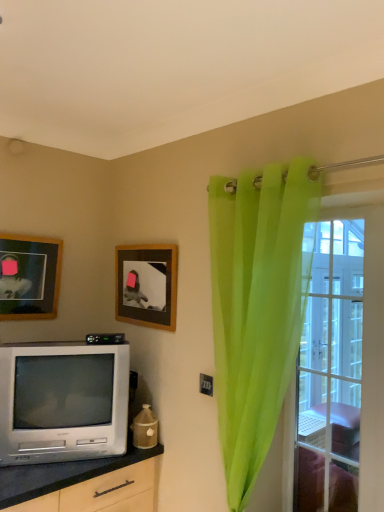
Describe the element at coordinates (146, 285) in the screenshot. I see `wooden picture frame at upper center, marked as the 1th picture frame in a right-to-left arrangement` at that location.

Where is `wooden picture frame at upper center, which is counted as the 2th picture frame, starting from the left`? This screenshot has width=384, height=512. wooden picture frame at upper center, which is counted as the 2th picture frame, starting from the left is located at coordinates (146, 285).

Identify the location of wooden picture frame at upper left, the second picture frame in the right-to-left sequence. (29, 277).

Where is `silver metallic television at lower left`? This screenshot has width=384, height=512. silver metallic television at lower left is located at coordinates point(63,402).

Locate an element on the screen. This screenshot has height=512, width=384. wooden picture frame at upper center, marked as the 1th picture frame in a right-to-left arrangement is located at coordinates (146, 285).

From a real-world perspective, does silver metallic television at lower left sit lower than translucent green curtain at right?

Yes, from a real-world perspective, silver metallic television at lower left is below translucent green curtain at right.

At what (x,y) coordinates should I click in order to perform the action: click on television lying on the left of translucent green curtain at right. Please return your answer as a coordinate pair (x, y). Looking at the image, I should click on (63, 402).

Which is behind, point (122, 408) or point (255, 242)?

The point (122, 408) is more distant.

Is silver metallic television at lower left thinner than translucent green curtain at right?

In fact, silver metallic television at lower left might be wider than translucent green curtain at right.

Would you say clear glass door at right contains silver metallic television at lower left?

→ That's incorrect, silver metallic television at lower left is not inside clear glass door at right.

Can you confirm if clear glass door at right is thinner than silver metallic television at lower left?

Correct, the width of clear glass door at right is less than that of silver metallic television at lower left.

This screenshot has width=384, height=512. Identify the location of window located on the right of silver metallic television at lower left. (341, 369).

Considering the sizes of clear glass door at right and silver metallic television at lower left in the image, is clear glass door at right taller or shorter than silver metallic television at lower left?

clear glass door at right is taller than silver metallic television at lower left.

Is wooden picture frame at upper left, the second picture frame in the right-to-left sequence, not within silver metallic television at lower left?

Absolutely, wooden picture frame at upper left, the second picture frame in the right-to-left sequence, is external to silver metallic television at lower left.

How distant is wooden picture frame at upper left, the second picture frame in the right-to-left sequence, from silver metallic television at lower left?

21.96 inches.

From a real-world perspective, who is located lower, wooden picture frame at upper left, which appears as the 1th picture frame when viewed from the left, or silver metallic television at lower left?

In real-world perspective, silver metallic television at lower left is lower.

How different are the orientations of wooden picture frame at upper left, which appears as the 1th picture frame when viewed from the left, and silver metallic television at lower left in degrees?

They differ by 26.2 degrees in their facing directions.

Considering the sizes of objects wooden picture frame at upper left, which appears as the 1th picture frame when viewed from the left, and clear glass door at right in the image provided, who is shorter, wooden picture frame at upper left, which appears as the 1th picture frame when viewed from the left, or clear glass door at right?

wooden picture frame at upper left, which appears as the 1th picture frame when viewed from the left, is shorter.

Is wooden picture frame at upper left, which appears as the 1th picture frame when viewed from the left, bigger or smaller than clear glass door at right?

Clearly, wooden picture frame at upper left, which appears as the 1th picture frame when viewed from the left, is smaller in size than clear glass door at right.

From a real-world perspective, which object rests below the other?

clear glass door at right is physically lower.

From the image's perspective, is wooden picture frame at upper left, which appears as the 1th picture frame when viewed from the left, beneath clear glass door at right?

Incorrect, from the image's perspective, wooden picture frame at upper left, which appears as the 1th picture frame when viewed from the left, is higher than clear glass door at right.

Can you tell me how much wooden picture frame at upper center, which is counted as the 2th picture frame, starting from the left, and wooden picture frame at upper left, the second picture frame in the right-to-left sequence, differ in facing direction?

The angular difference between wooden picture frame at upper center, which is counted as the 2th picture frame, starting from the left, and wooden picture frame at upper left, the second picture frame in the right-to-left sequence, is 89.8 degrees.

Image resolution: width=384 pixels, height=512 pixels. I want to click on picture frame below the wooden picture frame at upper left, which appears as the 1th picture frame when viewed from the left (from the image's perspective), so click(x=146, y=285).

Considering the relative sizes of wooden picture frame at upper center, which is counted as the 2th picture frame, starting from the left, and wooden picture frame at upper left, the second picture frame in the right-to-left sequence, in the image provided, is wooden picture frame at upper center, which is counted as the 2th picture frame, starting from the left, wider than wooden picture frame at upper left, the second picture frame in the right-to-left sequence,?

Correct, the width of wooden picture frame at upper center, which is counted as the 2th picture frame, starting from the left, exceeds that of wooden picture frame at upper left, the second picture frame in the right-to-left sequence.

Does wooden picture frame at upper center, which is counted as the 2th picture frame, starting from the left, turn towards wooden picture frame at upper left, the second picture frame in the right-to-left sequence?

Yes, wooden picture frame at upper center, which is counted as the 2th picture frame, starting from the left, is oriented towards wooden picture frame at upper left, the second picture frame in the right-to-left sequence.

Can you confirm if silver metallic television at lower left is bigger than clear glass door at right?

Indeed, silver metallic television at lower left has a larger size compared to clear glass door at right.

Considering the positions of point (128, 373) and point (360, 453), is point (128, 373) closer or farther from the camera than point (360, 453)?

Point (128, 373) is farther from the camera than point (360, 453).

Measure the distance from silver metallic television at lower left to clear glass door at right.

silver metallic television at lower left and clear glass door at right are 1.06 meters apart.

Is clear glass door at right a part of silver metallic television at lower left?

No, clear glass door at right is not a part of silver metallic television at lower left.

Considering the relative sizes of silver metallic television at lower left and wooden picture frame at upper left, the second picture frame in the right-to-left sequence, in the image provided, is silver metallic television at lower left taller than wooden picture frame at upper left, the second picture frame in the right-to-left sequence,?

Correct, silver metallic television at lower left is much taller as wooden picture frame at upper left, the second picture frame in the right-to-left sequence.

Is wooden picture frame at upper left, the second picture frame in the right-to-left sequence, surrounded by silver metallic television at lower left?

That's incorrect, wooden picture frame at upper left, the second picture frame in the right-to-left sequence, is not inside silver metallic television at lower left.

Relative to wooden picture frame at upper left, the second picture frame in the right-to-left sequence, is silver metallic television at lower left in front or behind?

Clearly, silver metallic television at lower left is in front of wooden picture frame at upper left, the second picture frame in the right-to-left sequence.

Where is `curtain that appears above the silver metallic television at lower left (from a real-world perspective)`? This screenshot has height=512, width=384. curtain that appears above the silver metallic television at lower left (from a real-world perspective) is located at coordinates (258, 305).

Identify the location of window in front of the silver metallic television at lower left. The image size is (384, 512). (341, 369).

Looking at the image, which one is located closer to wooden picture frame at upper center, marked as the 1th picture frame in a right-to-left arrangement, wooden picture frame at upper left, the second picture frame in the right-to-left sequence, or clear glass door at right?

The object closer to wooden picture frame at upper center, marked as the 1th picture frame in a right-to-left arrangement, is wooden picture frame at upper left, the second picture frame in the right-to-left sequence.

Estimate the real-world distances between objects in this image. Which object is closer to wooden picture frame at upper center, marked as the 1th picture frame in a right-to-left arrangement, translucent green curtain at right or silver metallic television at lower left?

silver metallic television at lower left is positioned closer to the anchor wooden picture frame at upper center, marked as the 1th picture frame in a right-to-left arrangement.

Considering their positions, is wooden picture frame at upper left, the second picture frame in the right-to-left sequence, positioned closer to silver metallic television at lower left than clear glass door at right?

Based on the image, wooden picture frame at upper left, the second picture frame in the right-to-left sequence, appears to be nearer to silver metallic television at lower left.

Which object lies nearer to the anchor point wooden picture frame at upper center, which is counted as the 2th picture frame, starting from the left, silver metallic television at lower left or wooden picture frame at upper left, the second picture frame in the right-to-left sequence?

Based on the image, silver metallic television at lower left appears to be nearer to wooden picture frame at upper center, which is counted as the 2th picture frame, starting from the left.

From the picture: Looking at the image, which one is located closer to translucent green curtain at right, clear glass door at right or silver metallic television at lower left?

clear glass door at right.

When comparing their distances from clear glass door at right, does translucent green curtain at right or wooden picture frame at upper left, the second picture frame in the right-to-left sequence, seem closer?

Based on the image, translucent green curtain at right appears to be nearer to clear glass door at right.

Estimate the real-world distances between objects in this image. Which object is closer to clear glass door at right, silver metallic television at lower left or wooden picture frame at upper center, which is counted as the 2th picture frame, starting from the left?

The object closer to clear glass door at right is wooden picture frame at upper center, which is counted as the 2th picture frame, starting from the left.

From the image, which object appears to be farther from clear glass door at right, wooden picture frame at upper left, the second picture frame in the right-to-left sequence, or translucent green curtain at right?

wooden picture frame at upper left, the second picture frame in the right-to-left sequence, is positioned further to the anchor clear glass door at right.

The width and height of the screenshot is (384, 512). I want to click on picture frame between silver metallic television at lower left and translucent green curtain at right in the horizontal direction, so click(x=146, y=285).

The width and height of the screenshot is (384, 512). I want to click on curtain between wooden picture frame at upper left, the second picture frame in the right-to-left sequence, and clear glass door at right, in the horizontal direction, so click(x=258, y=305).

The height and width of the screenshot is (512, 384). Identify the location of picture frame located between silver metallic television at lower left and clear glass door at right in the left-right direction. (146, 285).

The image size is (384, 512). In order to click on picture frame located between wooden picture frame at upper left, the second picture frame in the right-to-left sequence, and translucent green curtain at right in the left-right direction in this screenshot , I will do `click(146, 285)`.